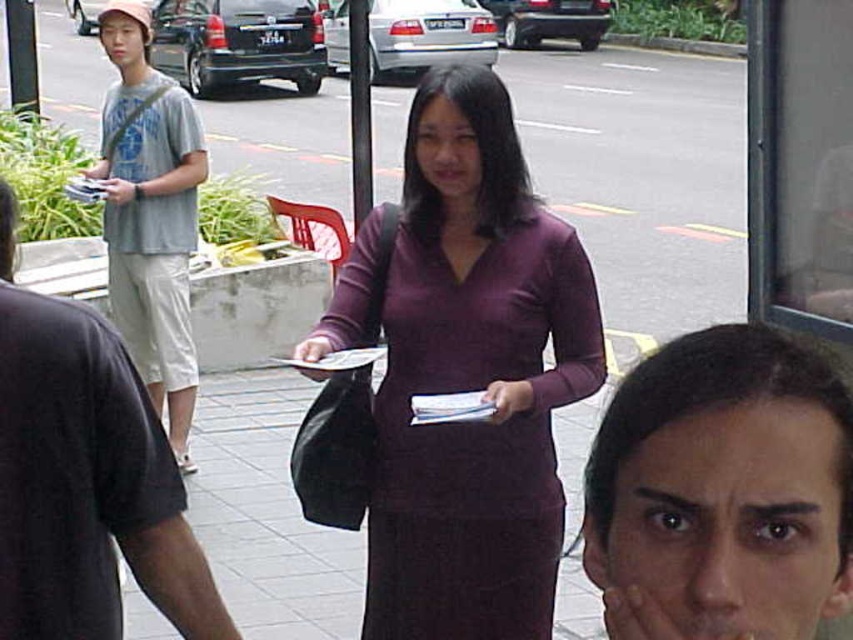
You are standing at the bus stop and see the purple matte dress at center. If you need to reach the dress quickly, which direction should you move towards?

The purple matte dress at center is located at point (474, 378), so you should move towards the center of the scene to reach it quickly.

You are standing at the camera position. Where is the purple matte dress at center located in the image?

The purple matte dress at center is located at point (474, 378) in the image.